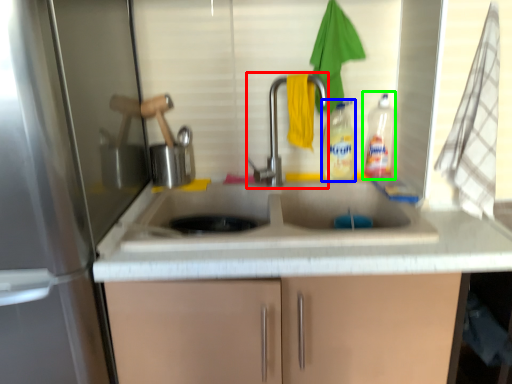
Question: Considering the real-world distances, which object is farthest from tap (highlighted by a red box)? bottle (highlighted by a blue box) or bottle (highlighted by a green box)?

Choices:
 (A) bottle
 (B) bottle

Answer: (B)